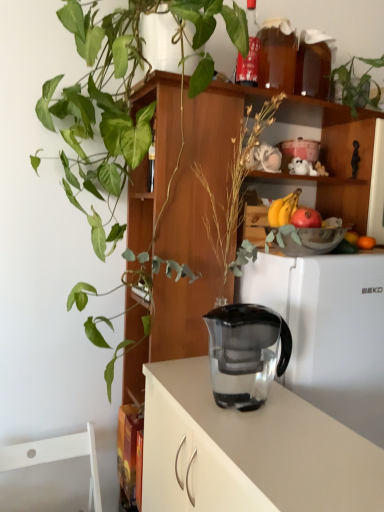
Locate an element on the screen. free location in front of transparent plastic jug at center is located at coordinates (270, 438).